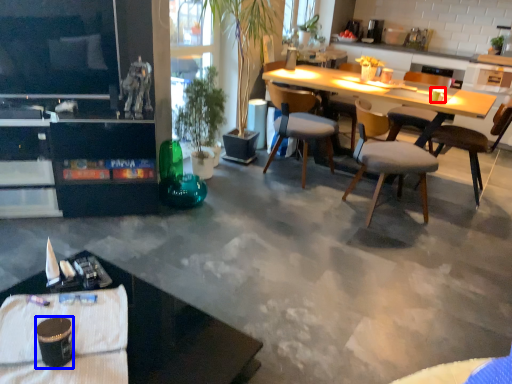
Question: Which of the following is the closest to the observer, coffee cup (highlighted by a red box) or coffee cup (highlighted by a blue box)?

Choices:
 (A) coffee cup
 (B) coffee cup

Answer: (B)